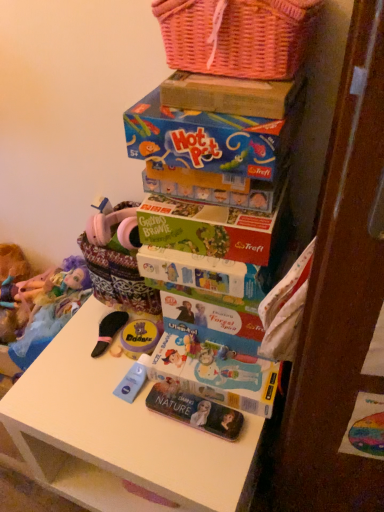
Locate an element on the screen. free spot above white matte table at center (from a real-world perspective) is located at coordinates (130, 389).